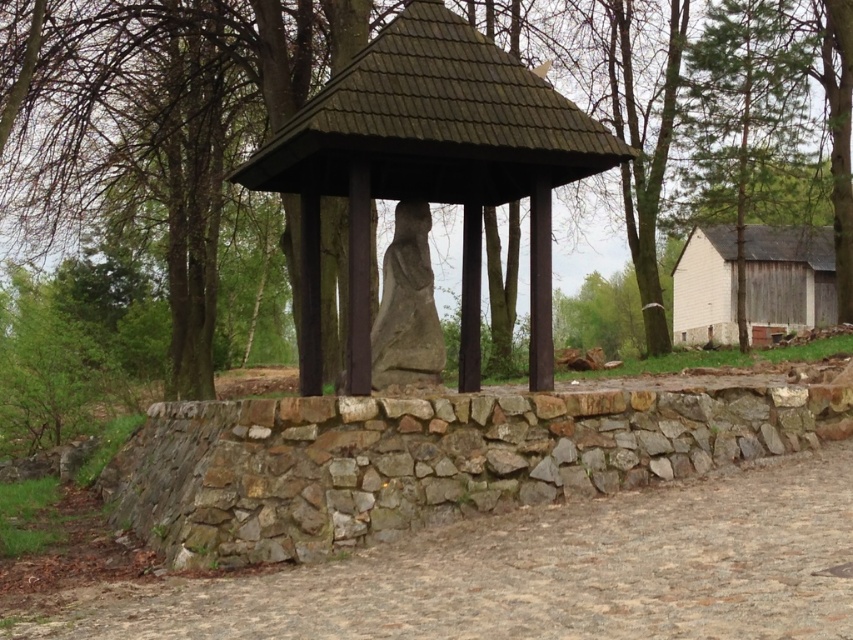
You are standing at the stone structure with a wooden roof in the park. There are two points marked on the ground, one at coordinates point (695,584) and another at point (213,177). If you want to walk from the first point to the second point, which direction should you move relative to the structure?

To move from point (695,584) to point (213,177), you should move towards the direction away from the structure since point (695,584) is in front of point (213,177). This means the second point is behind the structure relative to your starting position.

You are standing at the stone structure with a wooden roof in the park. You see two points marked on the ground. The first point is at coordinates point [550,177] and the second point is at point [730,291]. If you are facing the direction of the stone sculpture, which point is closer to you?

Point [550,177] is in front of point [730,291], so if you are facing the stone sculpture, point [550,177] is closer to you.